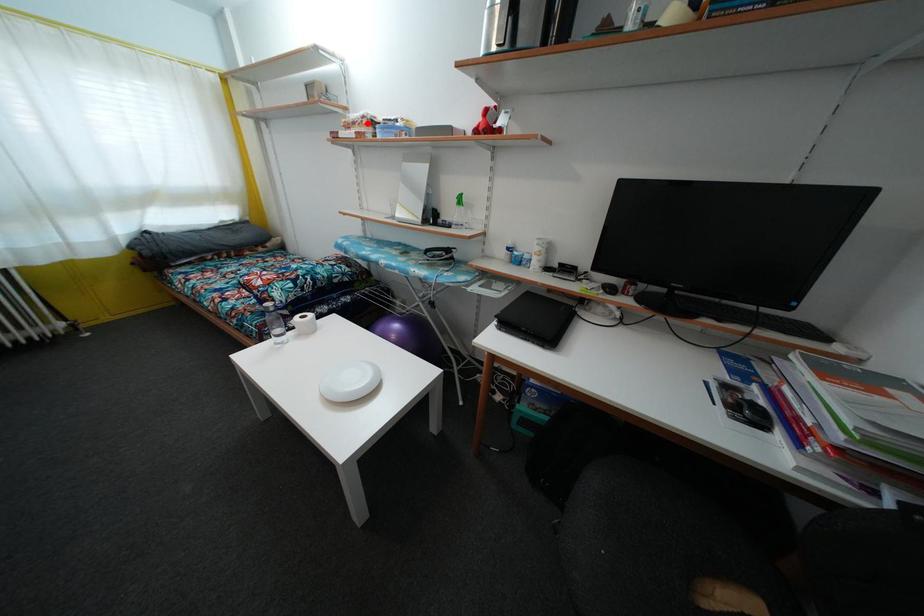
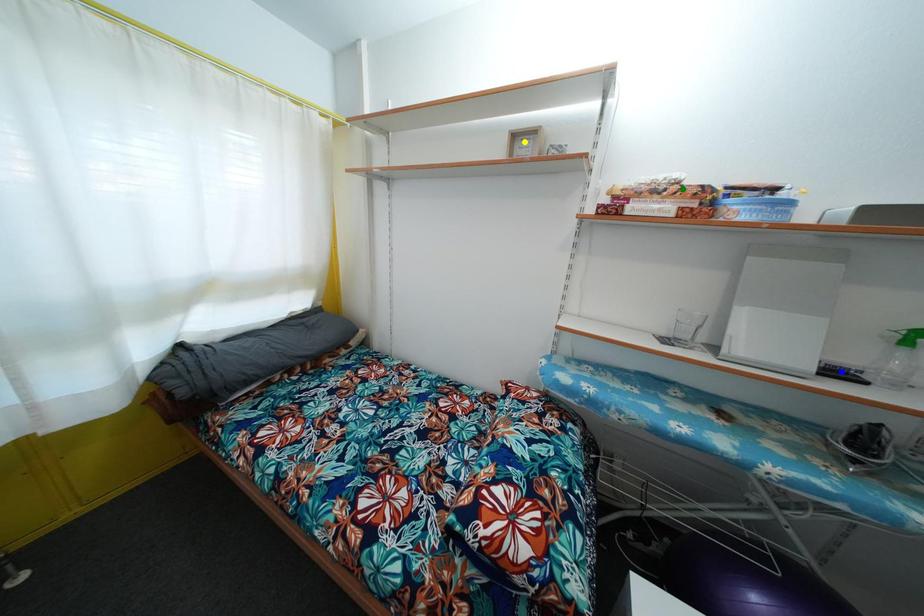
Question: I am providing you with two images of the same scene from different viewpoints. A red point is marked on the first image. You are given multiple points on the second image. Can you choose the point in image 2 that corresponds to the point in image 1?

Choices:
 (A) blue point
 (B) yellow point
 (C) green point

Answer: (C)